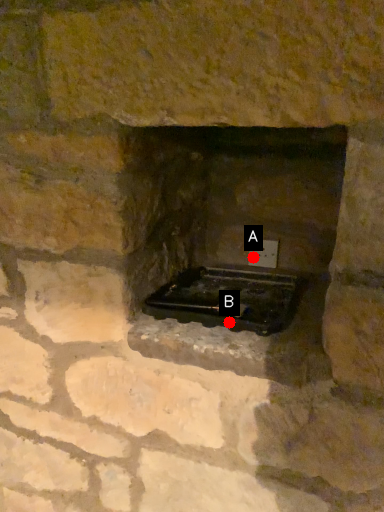
Question: Two points are circled on the image, labeled by A and B beside each circle. Which point is further to the camera?

Choices:
 (A) A is further
 (B) B is further

Answer: (A)